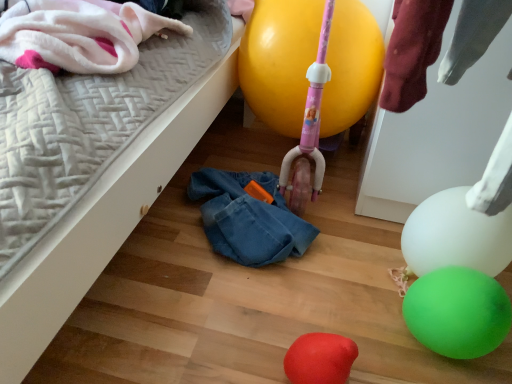
At what (x,y) coordinates should I click in order to perform the action: click on free space to the back side of green rubber balloon at lower right, the third balloon in the top-to-bottom sequence. Please return your answer as a coordinate pair (x, y). Looking at the image, I should click on (368, 263).